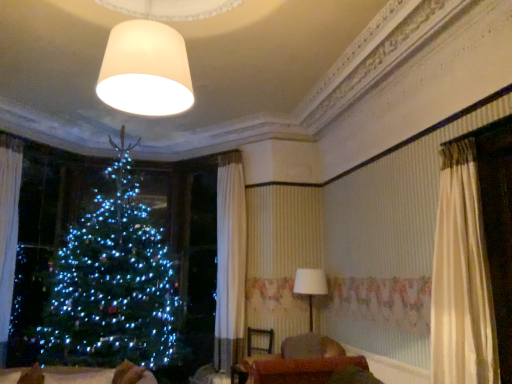
Question: Is point (264, 367) positioned closer to the camera than point (308, 289)?

Choices:
 (A) closer
 (B) farther

Answer: (A)

Question: From the image's perspective, relative to white fabric lampshade at center, acting as the 2th lamp starting from the left, is velvet brown sofa at lower center above or below?

Choices:
 (A) below
 (B) above

Answer: (A)

Question: Which object is positioned farthest from the white sheer curtain at left?

Choices:
 (A) white fabric lampshade at center, which is the 2th lamp from top to bottom
 (B) velvet brown sofa at lower center
 (C) velvet brown armchair at center
 (D) matte white lampshade at upper center, the 2th lamp viewed from the back

Answer: (A)

Question: Which object is positioned farthest from the white fabric lampshade at center, positioned as the 2th lamp in front-to-back order?

Choices:
 (A) velvet brown armchair at center
 (B) velvet brown sofa at lower center
 (C) matte white lampshade at upper center, positioned as the 1th lamp in left-to-right order
 (D) white sheer curtain at left

Answer: (D)